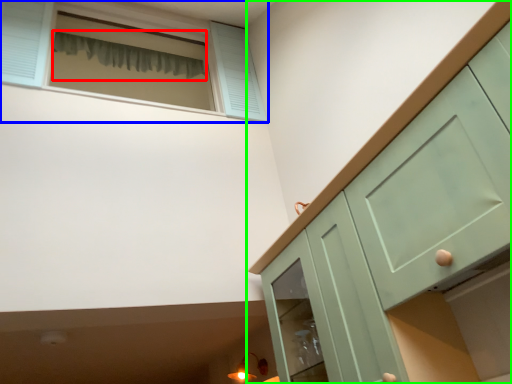
Question: Which object is the closest to the curtain (highlighted by a red box)? Choose among these: window (highlighted by a blue box) or cabinetry (highlighted by a green box).

Choices:
 (A) window
 (B) cabinetry

Answer: (A)